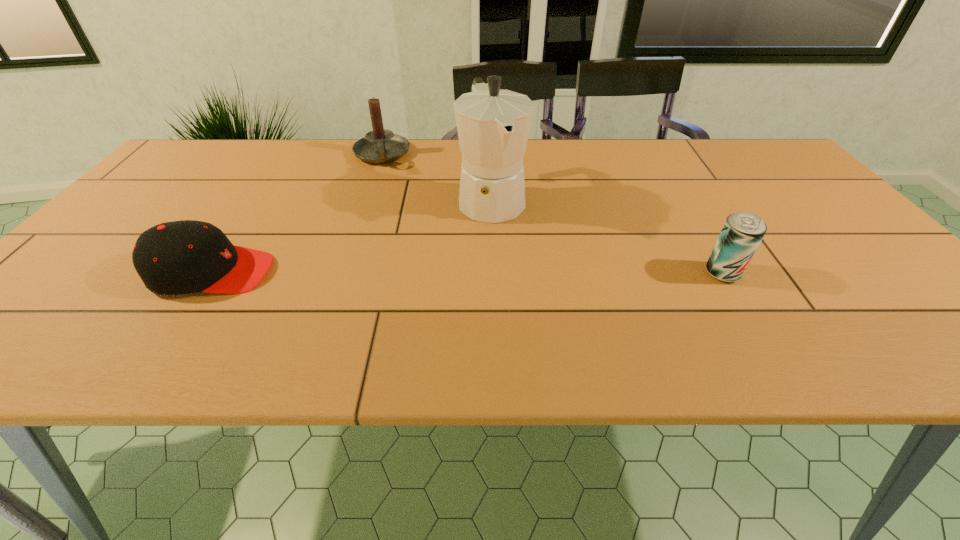
Locate an element on the screen. The width and height of the screenshot is (960, 540). the shortest object is located at coordinates (173, 258).

The image size is (960, 540). I want to click on the leftmost object, so click(173, 258).

The height and width of the screenshot is (540, 960). Find the location of `the rightmost object`. the rightmost object is located at coordinates (742, 232).

At what (x,y) coordinates should I click in order to perform the action: click on the second tallest object. Please return your answer as a coordinate pair (x, y). Looking at the image, I should click on (380, 145).

Where is `candle`? candle is located at coordinates (380, 145).

The image size is (960, 540). In order to click on the tallest object in this screenshot , I will do (x=493, y=125).

You are a GUI agent. You are given a task and a screenshot of the screen. Output one action in this format:
    pyautogui.click(x=<x>, y=<y>)
    Task: Click on the second object from right to left
    
    Given the screenshot: What is the action you would take?
    click(493, 125)

Identify the location of vacant space located 0.350m on the front-facing side of the leftmost object. The image size is (960, 540). (434, 272).

Image resolution: width=960 pixels, height=540 pixels. What are the coordinates of `free space located 0.220m on the back of the beer can` in the screenshot? It's located at (683, 206).

Locate an element on the screen. free location located on the side of the second tallest object with the handle loop is located at coordinates (384, 181).